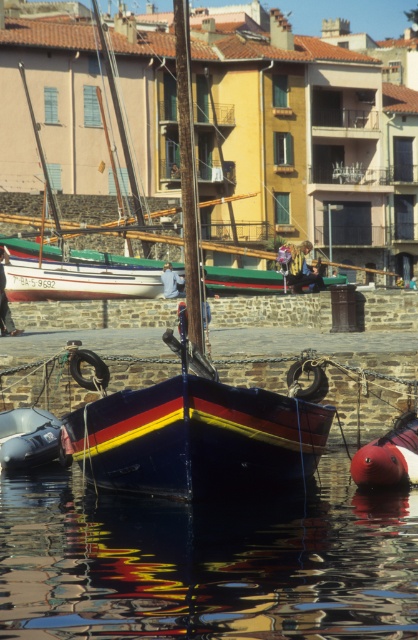
Does multicolored wooden boat at center have a greater height compared to metallic blue boat at lower left?

Yes.

Can you confirm if multicolored wooden boat at center is positioned above metallic blue boat at lower left?

Indeed, multicolored wooden boat at center is positioned over metallic blue boat at lower left.

Is point (38, 26) positioned behind point (38, 419)?

Yes, it is.

I want to click on multicolored wooden boat at center, so click(x=249, y=125).

Who is positioned more to the right, glossy water at center or multicolored wooden boat at center?

glossy water at center is more to the right.

Does glossy water at center lie in front of multicolored wooden boat at center?

Yes, glossy water at center is in front of multicolored wooden boat at center.

Does point (196, 508) come behind point (222, 49)?

No, (196, 508) is closer to viewer.

Find the location of `glossy water at center`. glossy water at center is located at coordinates (206, 561).

Which of these two, multicolored wooden boat at center or rubber red buoy at lower right, stands shorter?

rubber red buoy at lower right is shorter.

Who is positioned more to the left, multicolored wooden boat at center or rubber red buoy at lower right?

→ multicolored wooden boat at center is more to the left.

Is point (10, 184) closer to viewer compared to point (369, 449)?

No, it is behind (369, 449).

Locate an element on the screen. The height and width of the screenshot is (640, 418). multicolored wooden boat at center is located at coordinates pyautogui.click(x=249, y=125).